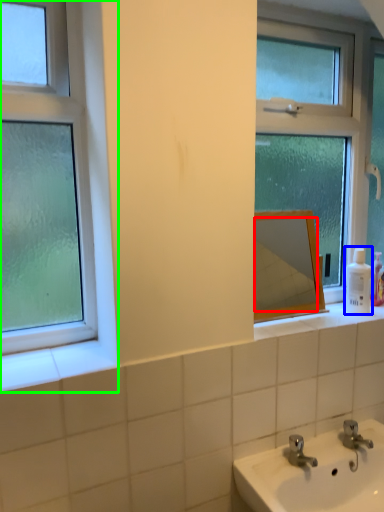
Question: Considering the real-world distances, which object is farthest from mirror (highlighted by a red box)? toiletry (highlighted by a blue box) or window (highlighted by a green box)?

Choices:
 (A) toiletry
 (B) window

Answer: (B)